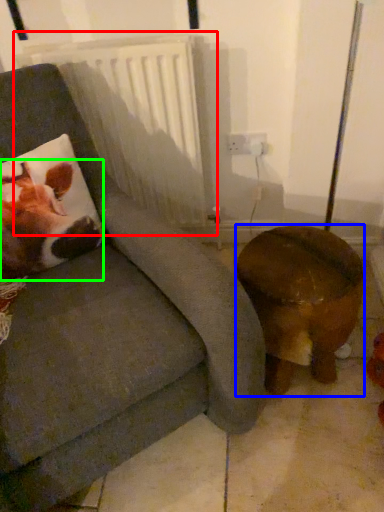
Question: Which object is positioned farthest from radiator (highlighted by a red box)? Select from furniture (highlighted by a blue box) and animal (highlighted by a green box).

Choices:
 (A) furniture
 (B) animal

Answer: (A)